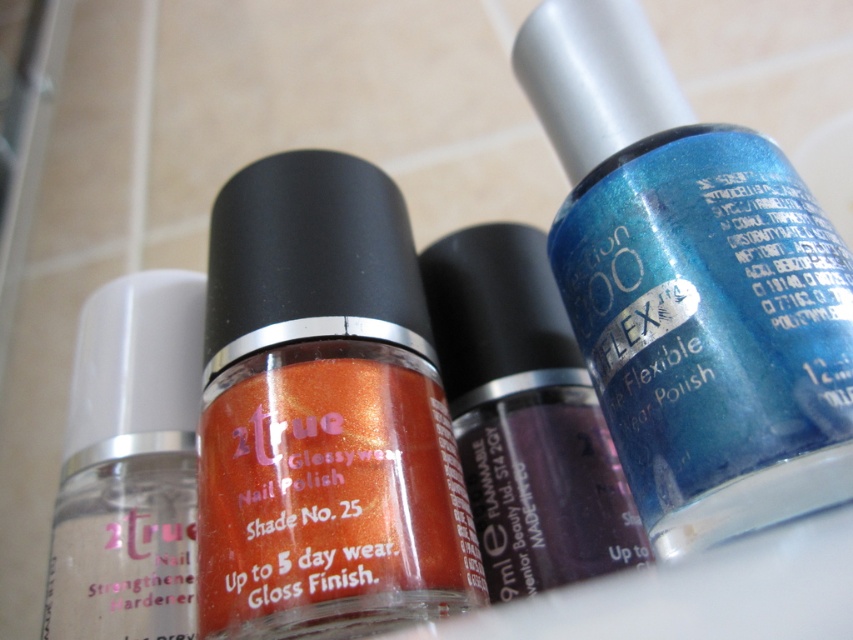
Does shiny blue nail polish at center appear over shiny orange nail polish at center?

Yes.

Does point (631, 257) come farther from viewer compared to point (206, 604)?

Yes, it is behind point (206, 604).

In order to click on shiny blue nail polish at center in this screenshot , I will do `click(689, 285)`.

At what (x,y) coordinates should I click in order to perform the action: click on shiny blue nail polish at center. Please return your answer as a coordinate pair (x, y). Image resolution: width=853 pixels, height=640 pixels. Looking at the image, I should click on (689, 285).

Does shiny purple nail polish at center appear under transparent matte nail strengthener at left?

Incorrect, shiny purple nail polish at center is not positioned below transparent matte nail strengthener at left.

In the scene shown: Which of these two, shiny purple nail polish at center or transparent matte nail strengthener at left, stands shorter?

transparent matte nail strengthener at left

You are a GUI agent. You are given a task and a screenshot of the screen. Output one action in this format:
    pyautogui.click(x=<x>, y=<y>)
    Task: Click on the shiny purple nail polish at center
    This screenshot has height=640, width=853.
    Given the screenshot: What is the action you would take?
    pyautogui.click(x=525, y=416)

Locate an element on the screen. shiny purple nail polish at center is located at coordinates (525, 416).

Is point (339, 289) positioned behind point (552, 536)?

No, it is in front of (552, 536).

Who is higher up, shiny orange nail polish at center or shiny purple nail polish at center?

Positioned higher is shiny orange nail polish at center.

Where is `shiny orange nail polish at center`? shiny orange nail polish at center is located at coordinates (323, 413).

Locate an element on the screen. The height and width of the screenshot is (640, 853). shiny orange nail polish at center is located at coordinates (323, 413).